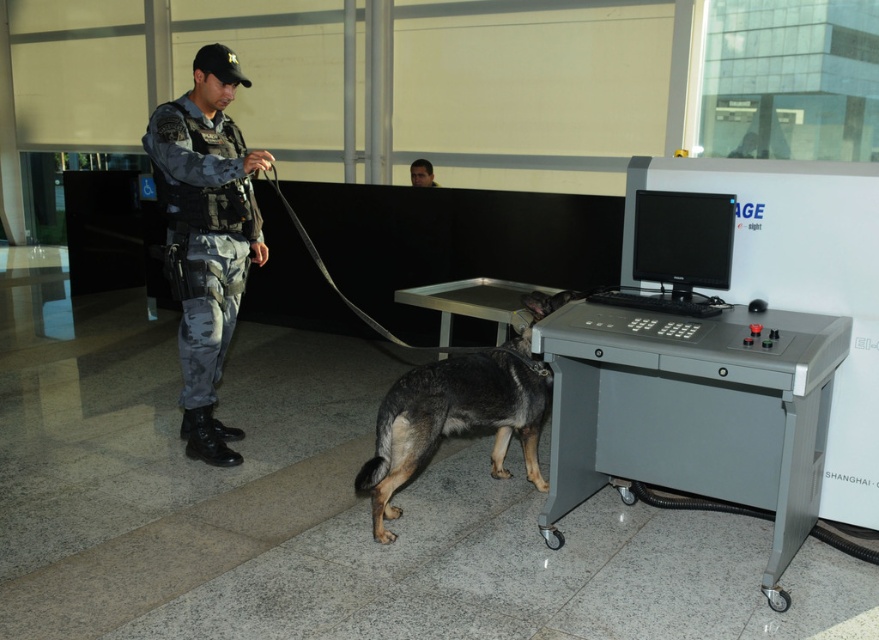
Measure the distance from gray metallic control panel at lower right to dark gray fur dog at center.

gray metallic control panel at lower right is 21.45 inches away from dark gray fur dog at center.

What do you see at coordinates (692, 412) in the screenshot? I see `gray metallic control panel at lower right` at bounding box center [692, 412].

Where is `gray metallic control panel at lower right`? gray metallic control panel at lower right is located at coordinates tap(692, 412).

Is point (808, 392) farther from camera compared to point (426, 163)?

That is False.

Between gray metallic control panel at lower right and smooth skin face at center, which one appears on the right side from the viewer's perspective?

From the viewer's perspective, gray metallic control panel at lower right appears more on the right side.

Does point (553, 404) come behind point (420, 173)?

No, (553, 404) is in front of (420, 173).

Image resolution: width=879 pixels, height=640 pixels. I want to click on gray metallic control panel at lower right, so click(692, 412).

Is dark gray fur dog at center positioned behind smooth skin face at center?

No, it is not.

Between dark gray fur dog at center and smooth skin face at center, which one has more height?

dark gray fur dog at center

What do you see at coordinates (461, 410) in the screenshot? The height and width of the screenshot is (640, 879). I see `dark gray fur dog at center` at bounding box center [461, 410].

The image size is (879, 640). Identify the location of dark gray fur dog at center. (461, 410).